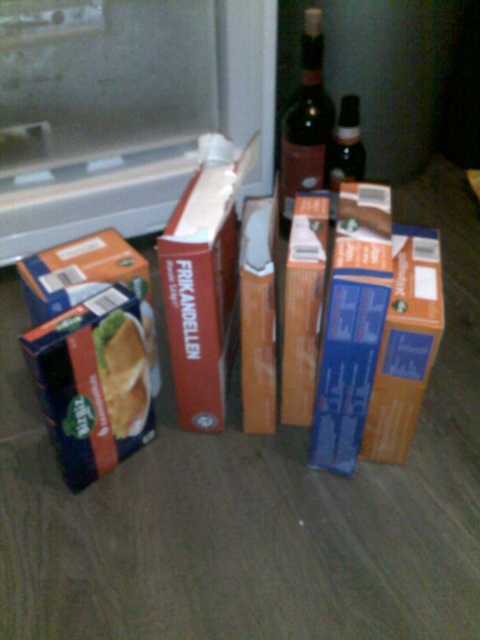
Question: Is blue cardboard box at lower left to the left of blue cardboard box at left from the viewer's perspective?

Choices:
 (A) yes
 (B) no

Answer: (B)

Question: Which object appears farthest from the camera in this image?

Choices:
 (A) blue cardboard box at left
 (B) golden crisp bread at left
 (C) blue cardboard box at lower left

Answer: (A)

Question: From the image, what is the correct spatial relationship of blue cardboard box at left in relation to shiny dark glass bottle at upper center?

Choices:
 (A) right
 (B) left

Answer: (B)

Question: Among these points, which one is farthest from the camera?

Choices:
 (A) (327, 132)
 (B) (145, 365)
 (C) (118, 252)
 (D) (94, 298)

Answer: (A)

Question: From the image, what is the correct spatial relationship of blue cardboard box at left in relation to golden crisp bread at left?

Choices:
 (A) right
 (B) left

Answer: (B)

Question: Based on their relative distances, which object is nearer to the blue cardboard box at lower left?

Choices:
 (A) golden crisp bread at left
 (B) blue cardboard box at left

Answer: (A)